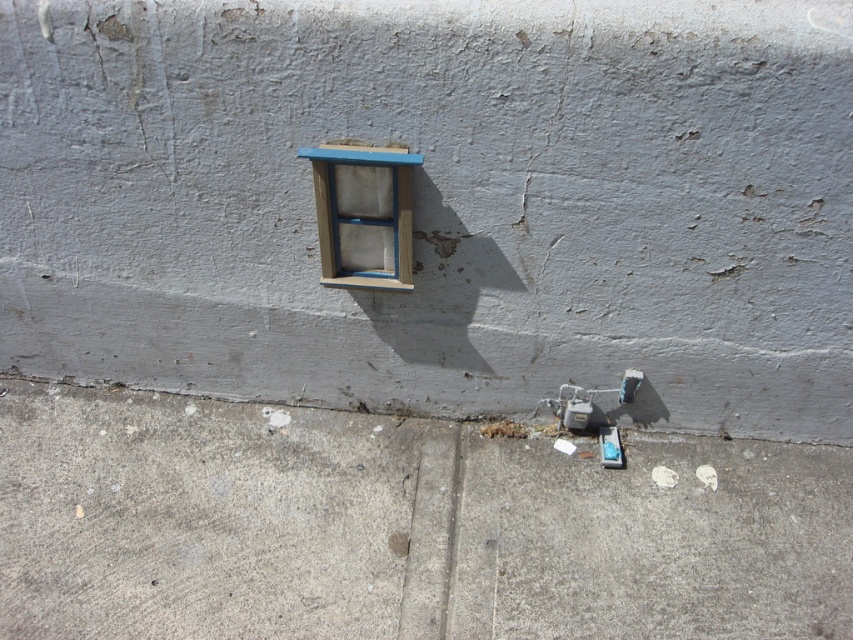
Question: Which point is closer to the camera?

Choices:
 (A) smooth concrete at lower center
 (B) wooden frame at center
 (C) gray concrete sidewalk at lower center

Answer: (A)

Question: Which point appears closest to the camera in this image?

Choices:
 (A) (465, 400)
 (B) (791, 449)

Answer: (A)

Question: Is smooth concrete at lower center thinner than wooden frame at center?

Choices:
 (A) no
 (B) yes

Answer: (A)

Question: Can you confirm if smooth concrete at lower center is positioned below gray concrete sidewalk at lower center?

Choices:
 (A) yes
 (B) no

Answer: (B)

Question: Which of the following is the farthest from the observer?

Choices:
 (A) gray concrete sidewalk at lower center
 (B) smooth concrete at lower center
 (C) wooden frame at center

Answer: (A)

Question: Does gray concrete sidewalk at lower center come behind wooden frame at center?

Choices:
 (A) no
 (B) yes

Answer: (B)